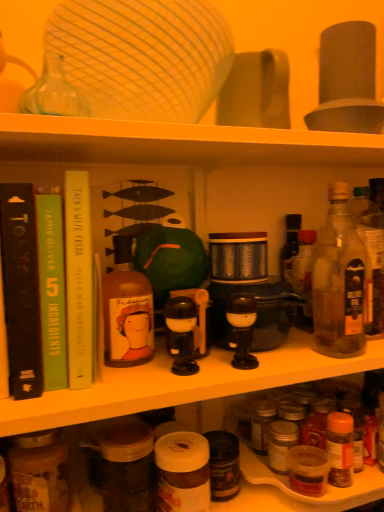
Find the location of a particular element. The width and height of the screenshot is (384, 512). vacant area that lies to the right of green paperback book at left, the second book viewed from the left is located at coordinates click(x=162, y=375).